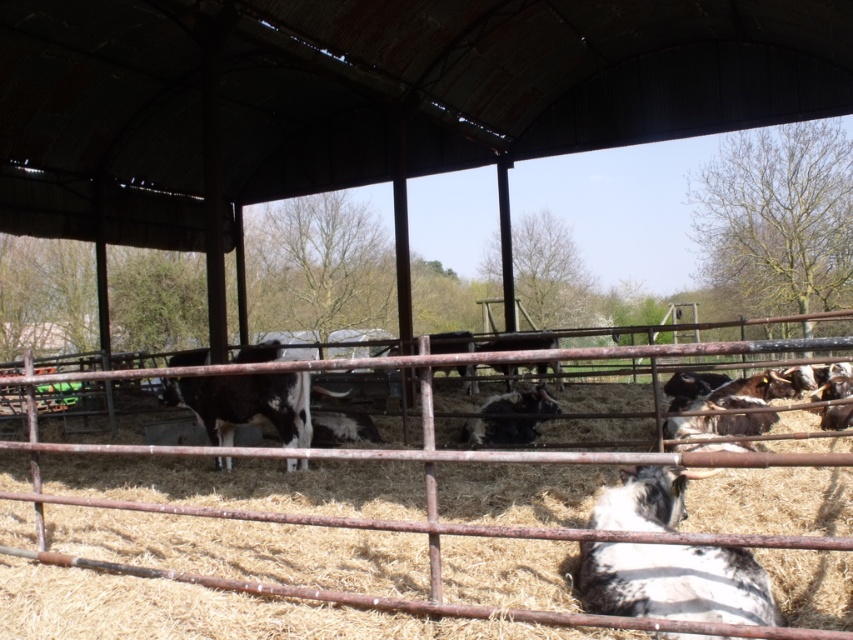
The height and width of the screenshot is (640, 853). What do you see at coordinates (337, 552) in the screenshot?
I see `rusty metal fence at center` at bounding box center [337, 552].

Between point (352, 492) and point (596, 515), which one is positioned behind?

The point (352, 492) is more distant.

Is point (61, 536) less distant than point (585, 561)?

That is False.

You are a GUI agent. You are given a task and a screenshot of the screen. Output one action in this format:
    pyautogui.click(x=<x>, y=<y>)
    Task: Click on the rusty metal fence at center
    The width and height of the screenshot is (853, 640).
    Given the screenshot: What is the action you would take?
    pyautogui.click(x=337, y=552)

What do you see at coordinates (675, 582) in the screenshot? I see `white speckled fur at center` at bounding box center [675, 582].

The height and width of the screenshot is (640, 853). Describe the element at coordinates (675, 582) in the screenshot. I see `white speckled fur at center` at that location.

The width and height of the screenshot is (853, 640). I want to click on white speckled fur at center, so click(x=675, y=582).

Can you confirm if rusty metal fence at center is wider than black and white cow at center?

Correct, the width of rusty metal fence at center exceeds that of black and white cow at center.

Does rusty metal fence at center come in front of black and white cow at center?

Yes, rusty metal fence at center is in front of black and white cow at center.

At what (x,y) coordinates should I click in order to perform the action: click on rusty metal fence at center. Please return your answer as a coordinate pair (x, y). Looking at the image, I should click on (337, 552).